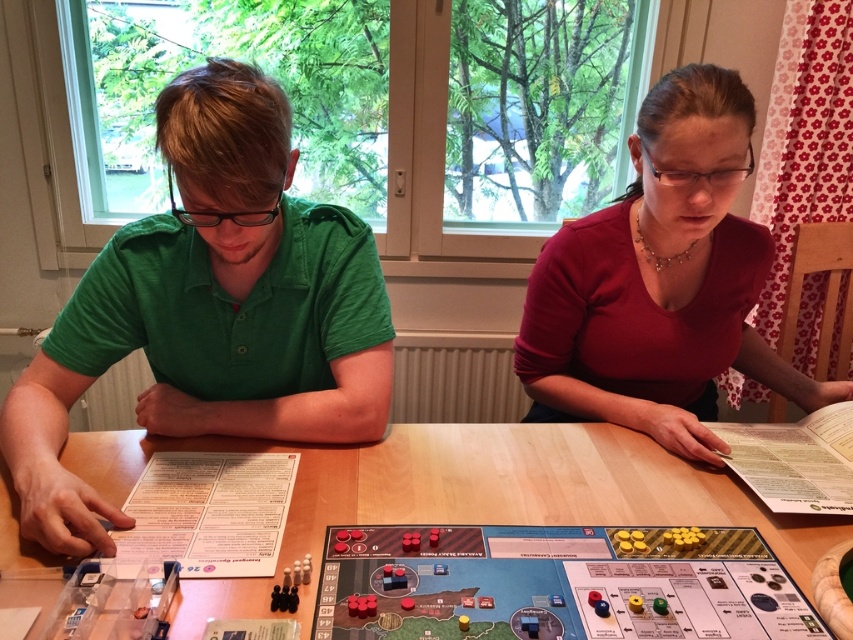
You are a game piece that needs to move from point (688, 166) to point (635, 456) on the board. Which direction should you move to get closer to your destination?

To move from point (688, 166) to point (635, 456), you should move towards the right and slightly downward since point (635, 456) is further away from the viewer compared to point (688, 166).

You are a photographer taking a picture of the wooden board game at center. To ensure the green cotton shirt at left does not appear in the shot, where should you position your camera?

The green cotton shirt at left is above the wooden board game at center, so positioning the camera below the wooden board game at center would avoid capturing the green cotton shirt at left in the frame.

Consider the image. You are a game piece that is 1 inch in diameter. You are currently on the wooden table at center and want to move to the matte red shirt at center. Is there enough space between them to move freely without touching any other objects?

The distance between the matte red shirt at center and the wooden table at center is 12.94 inches. Since the game piece is only 1 inch in diameter, there is ample space to move freely between them without touching other objects.